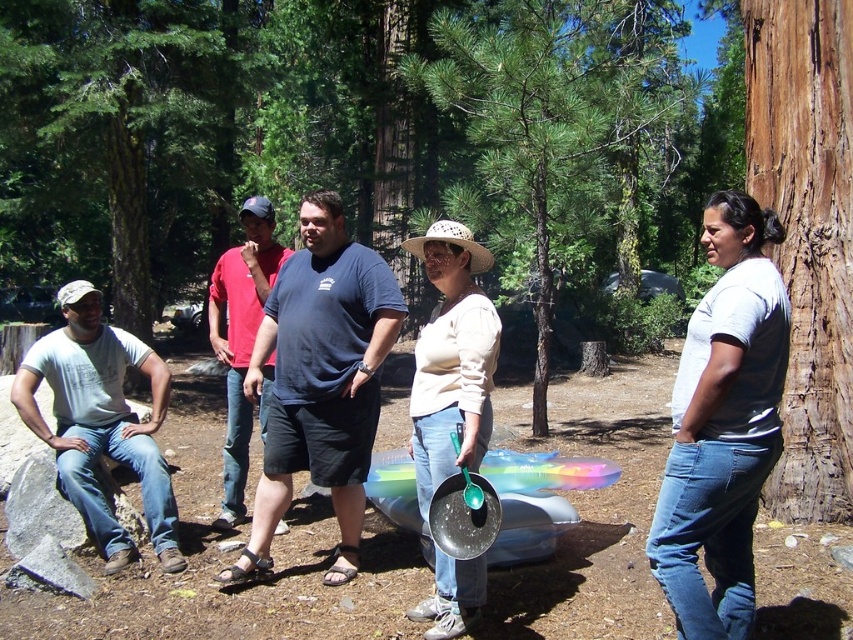
Question: Which point is farther from the camera taking this photo?

Choices:
 (A) (67, 364)
 (B) (741, 352)

Answer: (A)

Question: Can you confirm if green rough bark tree at left is wider than white matte shirt at center?

Choices:
 (A) yes
 (B) no

Answer: (A)

Question: Does dark blue t-shirt at center appear over matte blue shirt at center?

Choices:
 (A) yes
 (B) no

Answer: (B)

Question: Is green leafy tree at center thinner than gray cotton shirt at left?

Choices:
 (A) yes
 (B) no

Answer: (B)

Question: Which object is farther from the camera taking this photo?

Choices:
 (A) brown rough bark at right
 (B) gray cotton shirt at left
 (C) white matte shirt at center

Answer: (B)

Question: Considering the real-world distances, which object is farthest from the brown rough bark at right?

Choices:
 (A) gray cotton shirt at left
 (B) dark blue t-shirt at center
 (C) white matte shirt at center
 (D) green leafy tree at center

Answer: (D)